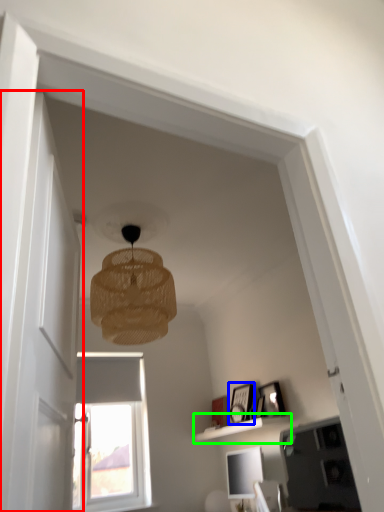
Question: Which object is positioned farthest from glass door (highlighted by a red box)? Select from picture frame (highlighted by a blue box) and shelf (highlighted by a green box).

Choices:
 (A) picture frame
 (B) shelf

Answer: (A)